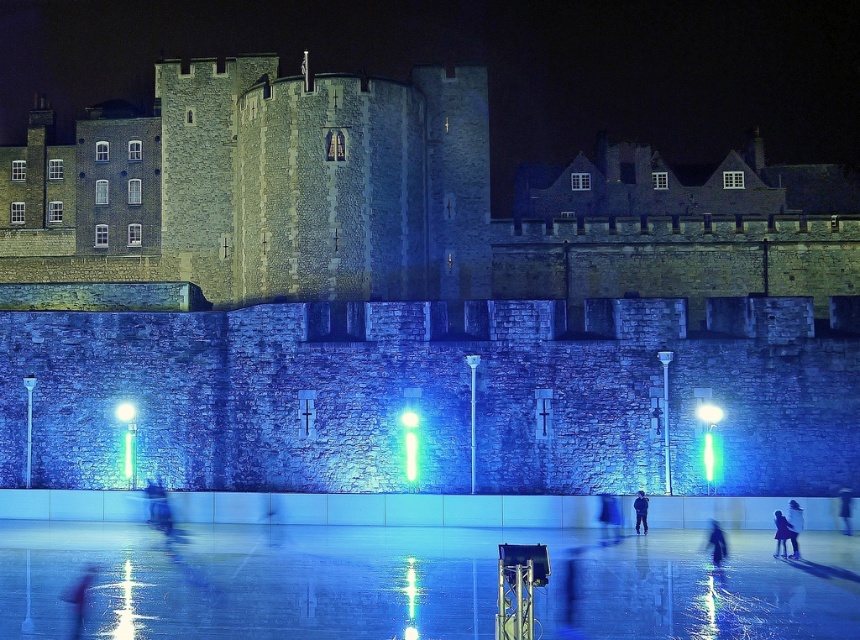
Question: Among these objects, which one is farthest from the camera?

Choices:
 (A) dark blue jeans at center
 (B) dark blue fabric jacket at lower right

Answer: (B)

Question: Is dark blue fabric jacket at lower right smaller than dark blue jeans at center?

Choices:
 (A) no
 (B) yes

Answer: (B)

Question: Which object is the farthest from the dark blue fabric coat at lower right?

Choices:
 (A) dark blue fabric jacket at lower right
 (B) stone wall at center
 (C) glossy ice rink at lower center
 (D) blue fabric jacket at center

Answer: (B)

Question: Can you confirm if stone wall at center is positioned to the left of blue fabric jacket at center?

Choices:
 (A) yes
 (B) no

Answer: (A)

Question: Which object is closer to the camera taking this photo?

Choices:
 (A) dark blue fabric coat at lower right
 (B) dark blue jeans at center
 (C) stone wall at center
 (D) glossy ice rink at lower center

Answer: (D)

Question: Can you confirm if glossy ice rink at lower center is wider than dark blue fabric coat at lower right?

Choices:
 (A) no
 (B) yes

Answer: (B)